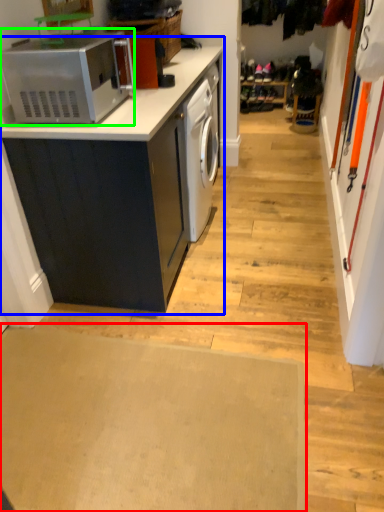
Question: Considering the real-world distances, which object is closest to plain (highlighted by a red box)? cabinetry (highlighted by a blue box) or home appliance (highlighted by a green box).

Choices:
 (A) cabinetry
 (B) home appliance

Answer: (A)